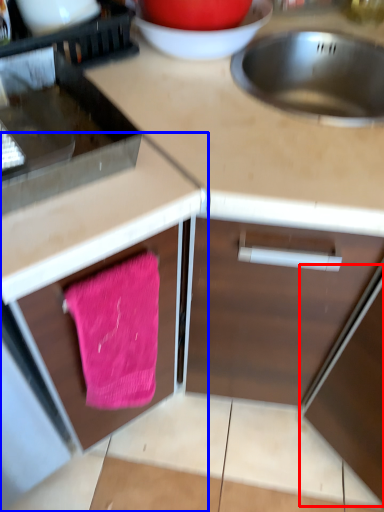
Question: Which point is closer to the camera, appliance (highlighted by a red box) or cabinetry (highlighted by a blue box)?

Choices:
 (A) appliance
 (B) cabinetry

Answer: (B)